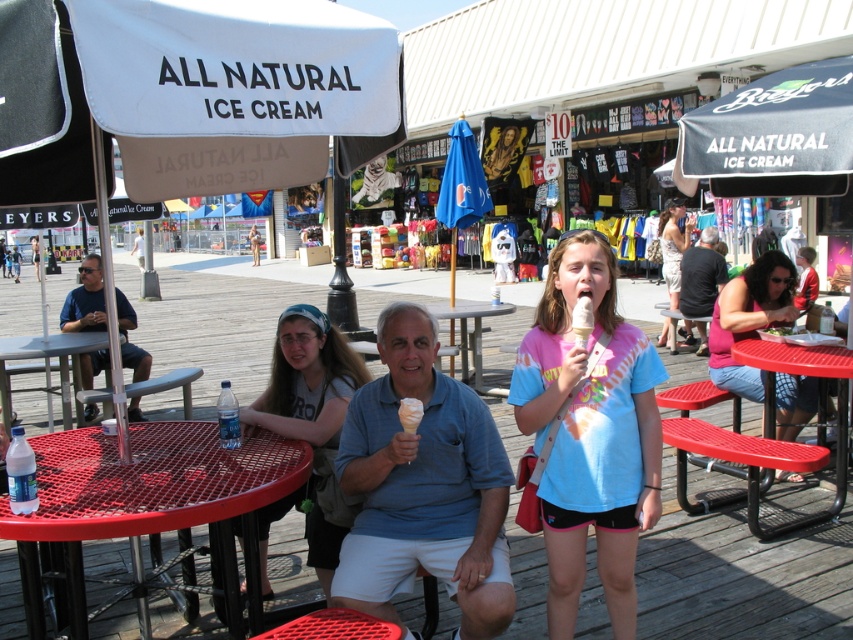
Question: Does red plastic table at lower right have a larger size compared to red metal table at center?

Choices:
 (A) yes
 (B) no

Answer: (B)

Question: Among these objects, which one is farthest from the camera?

Choices:
 (A) camouflage dress at center
 (B) matte gray shirt at center
 (C) tie-dye fabric ice cream cone at center

Answer: (A)

Question: Can you confirm if matte gray shirt at center is positioned above red metal table at center?

Choices:
 (A) yes
 (B) no

Answer: (B)

Question: Which point appears closest to the camera in this image?

Choices:
 (A) (323, 355)
 (B) (796, 262)

Answer: (A)

Question: Which of the following is the farthest from the observer?

Choices:
 (A) white creamy ice cream cone at center
 (B) vanilla ice cream at center
 (C) tie-dye fabric ice cream cone at center

Answer: (B)

Question: Is matte blue shirt at left positioned before white creamy ice cream cone at center?

Choices:
 (A) no
 (B) yes

Answer: (A)